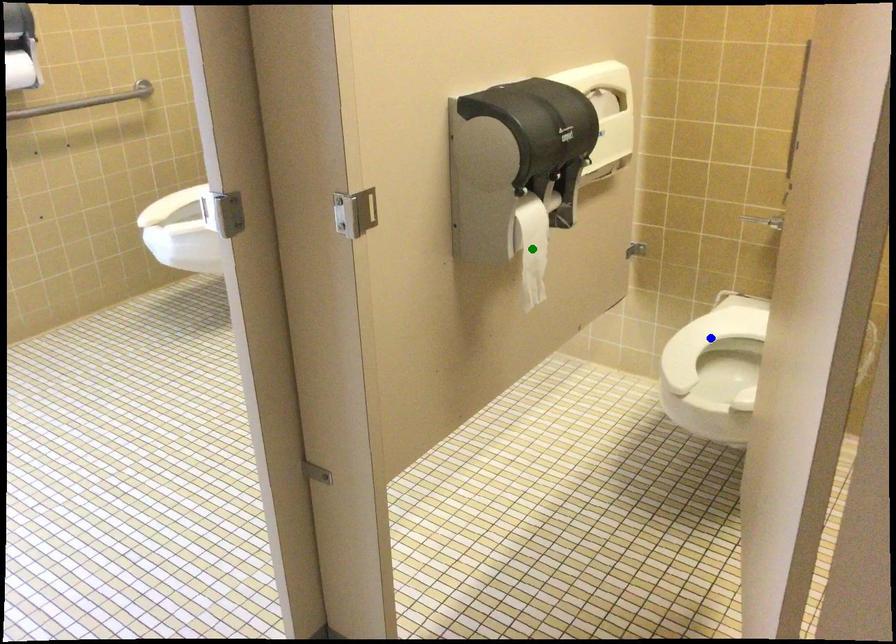
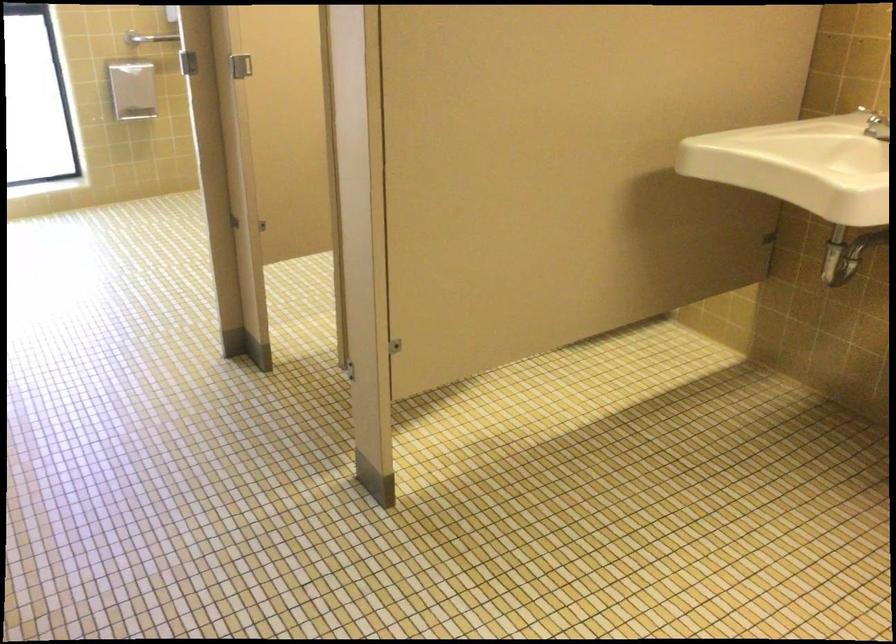
I am providing you with two images of the same scene from different viewpoints. Three points are marked in image1. Which point corresponds to a part or object that is occluded in image2?In image1, three points are marked. Which of them correspond to a part or object that is occluded in image2?Among the three points shown in image1, which one corresponds to a part or object that is no longer visible due to occlusion in image2?

yellow point, blue point, green point cannot be seen in image2.